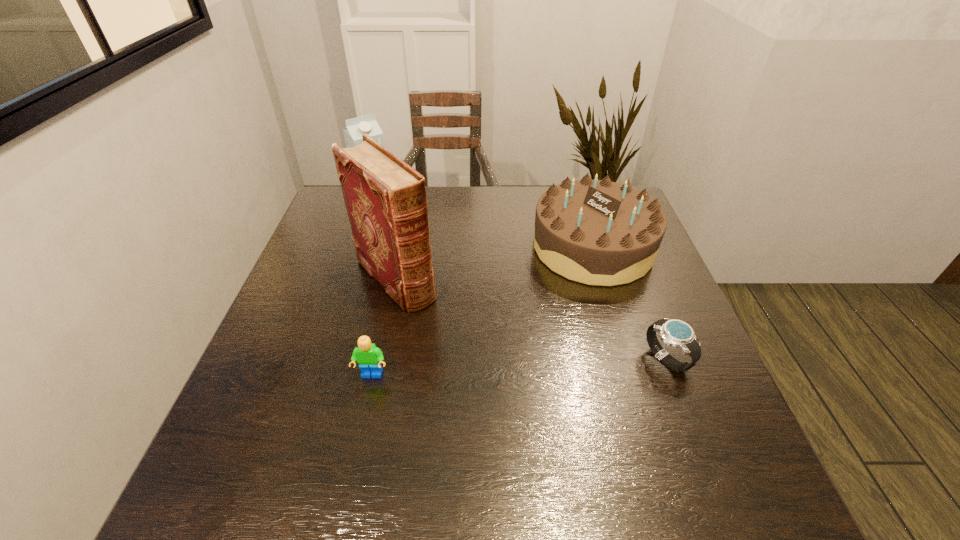
The image size is (960, 540). I want to click on vacant space located 0.300m on the front label of the second tallest object, so click(428, 266).

Find the location of a particular element. The height and width of the screenshot is (540, 960). vacant region located on the front label of the second tallest object is located at coordinates (398, 231).

Find the location of a particular element. vacant region located on the front label of the second tallest object is located at coordinates [x=423, y=260].

You are a GUI agent. You are given a task and a screenshot of the screen. Output one action in this format:
    pyautogui.click(x=<x>, y=<y>)
    Task: Click on the vacant area located 0.370m on the front-facing side of the birthday cake
    The width and height of the screenshot is (960, 540).
    Given the screenshot: What is the action you would take?
    pyautogui.click(x=492, y=383)

I want to click on free space located on the front-facing side of the birthday cake, so click(514, 354).

Where is `blank area located 0.260m on the front-facing side of the birthday cake`? blank area located 0.260m on the front-facing side of the birthday cake is located at coordinates (517, 348).

You are a GUI agent. You are given a task and a screenshot of the screen. Output one action in this format:
    pyautogui.click(x=<x>, y=<y>)
    Task: Click on the carton that is positioned at the far edge
    Image resolution: width=960 pixels, height=540 pixels.
    Given the screenshot: What is the action you would take?
    pyautogui.click(x=356, y=127)

Image resolution: width=960 pixels, height=540 pixels. Identify the location of birthday cake situated at the far edge. (596, 232).

You are a GUI agent. You are given a task and a screenshot of the screen. Output one action in this format:
    pyautogui.click(x=<x>, y=<y>)
    Task: Click on the hardback book present at the left edge
    
    Given the screenshot: What is the action you would take?
    pyautogui.click(x=385, y=198)

At what (x,y) coordinates should I click in order to perform the action: click on carton located in the left edge section of the desktop. Please return your answer as a coordinate pair (x, y). This screenshot has height=540, width=960. Looking at the image, I should click on (356, 127).